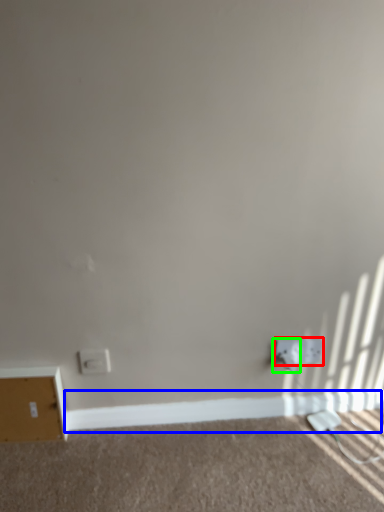
Question: Which object is the closest to the power plugs and sockets (highlighted by a red box)? Choose among these: molding (highlighted by a blue box) or electric outlet (highlighted by a green box).

Choices:
 (A) molding
 (B) electric outlet

Answer: (B)